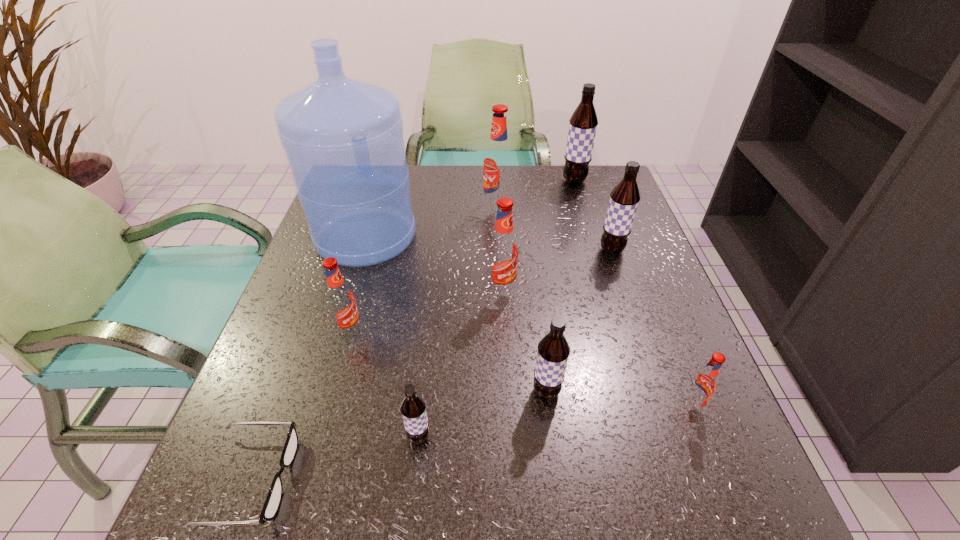
Locate an element on the screen. The width and height of the screenshot is (960, 540). vacant space situated 0.080m on the side of the blue water jug with the handle is located at coordinates click(x=379, y=192).

The height and width of the screenshot is (540, 960). Identify the location of free space located on the side of the blue water jug with the handle. pos(386,172).

At what (x,y) coordinates should I click in order to perform the action: click on free point located 0.050m on the side of the blue water jug with the handle. Please return your answer as a coordinate pair (x, y). This screenshot has height=540, width=960. Looking at the image, I should click on (377, 198).

Image resolution: width=960 pixels, height=540 pixels. What are the coordinates of `free spot located on the front of the farthest object` in the screenshot? It's located at pyautogui.click(x=595, y=252).

Locate an element on the screen. free spot located 0.220m on the right of the biggest red root beer is located at coordinates (594, 207).

You are a GUI agent. You are given a task and a screenshot of the screen. Output one action in this format:
    pyautogui.click(x=<x>, y=<y>)
    Task: Click on the vacant space located on the left of the sixth nearest root beer
    The width and height of the screenshot is (960, 540).
    Given the screenshot: What is the action you would take?
    pyautogui.click(x=437, y=250)

Locate an element on the screen. free space located 0.080m on the back of the fourth farthest root beer is located at coordinates (499, 256).

Find the location of a particular element. vacant space located on the right of the leftmost root beer is located at coordinates (496, 331).

Locate an element on the screen. The image size is (960, 540). free region located on the left of the second nearest brown root beer is located at coordinates (468, 392).

The image size is (960, 540). Identify the location of free space located on the back of the smallest red root beer. (660, 329).